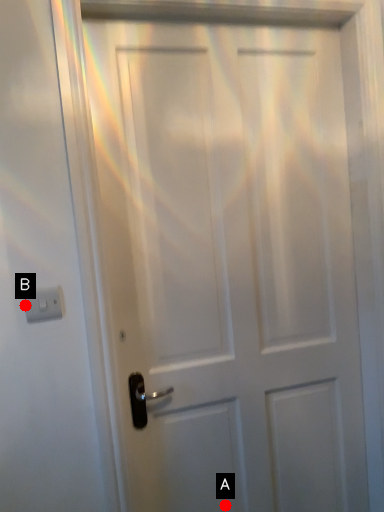
Question: Two points are circled on the image, labeled by A and B beside each circle. Among these points, which one is nearest to the camera?

Choices:
 (A) A is closer
 (B) B is closer

Answer: (B)